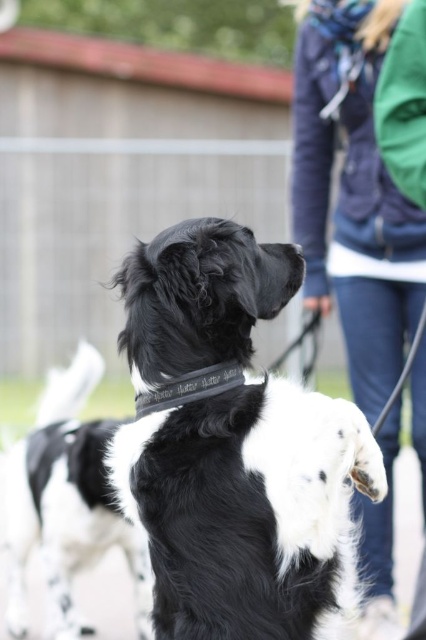
You are a photographer trying to capture the black and white fur dog at center and the black and white fur at center in the image. Which one is closer to the camera?

The black and white fur dog at center is closer to the camera than the black and white fur at center because it is positioned over it.

You are a dog trainer observing the black and white fur dog at center and the black leather neckband at center. Which object is located to the left?

The black leather neckband at center is located to the left of the black and white fur dog at center.

You are standing in front of the dog and want to place a treat at one of the two points shown in the image. Which point, point (178, 548) or point (46, 417), is closer to you?

Point (178, 548) is closer to the viewer than point (46, 417).